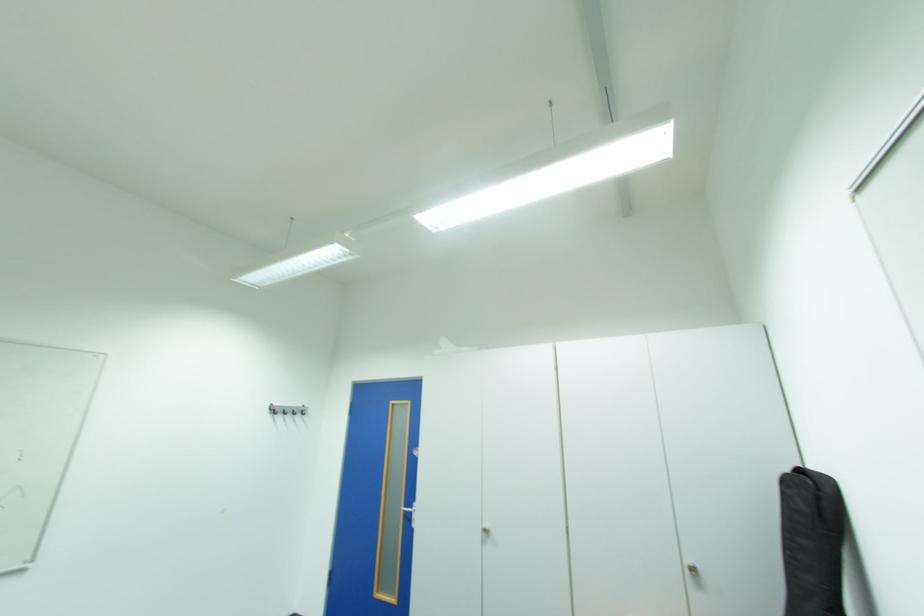
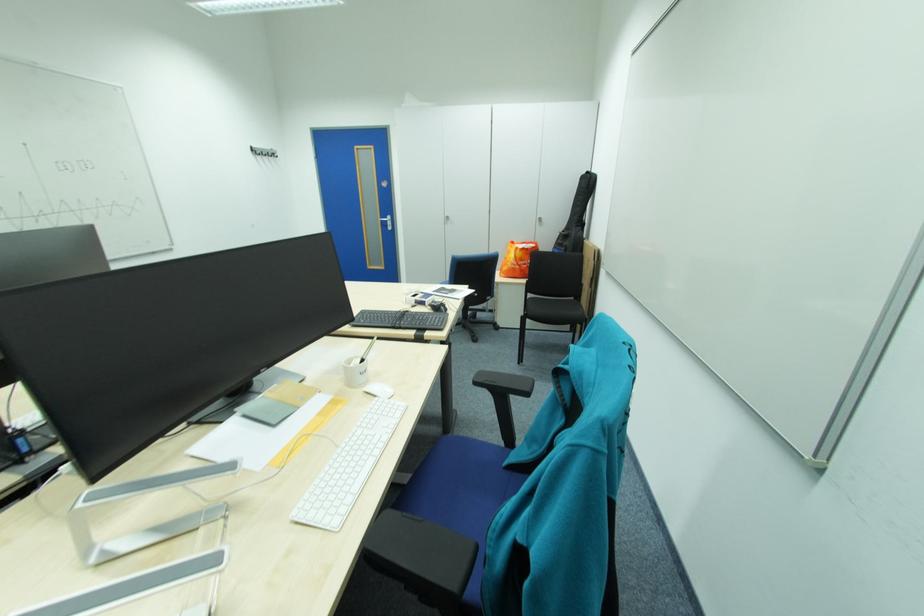
Find the pixel in the second image that matches (x=280, y=411) in the first image.

(262, 153)